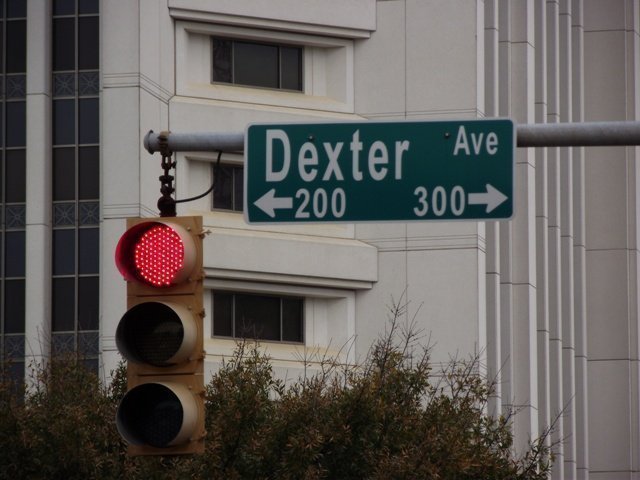
Locate an element on the screen. window of building is located at coordinates (79, 171), (15, 169), (249, 64), (232, 191), (257, 309).